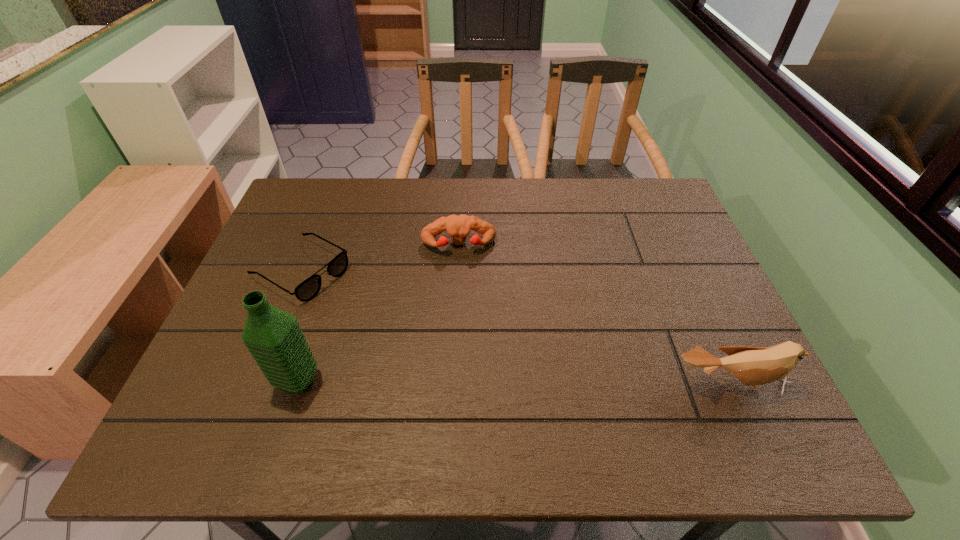
In the image, there is a desktop. At what (x,y) coordinates should I click in order to perform the action: click on free space at the left edge. Please return your answer as a coordinate pair (x, y). The image size is (960, 540). Looking at the image, I should click on (281, 233).

Identify the location of vacant region at the far left corner of the desktop. (334, 188).

Find the location of a particular element. The width and height of the screenshot is (960, 540). vacant area at the near left corner of the desktop is located at coordinates click(220, 396).

In the image, there is a desktop. Identify the location of free space at the far right corner. [655, 219].

Find the location of a particular element. free area in between the spectacles and the second tallest object is located at coordinates (516, 327).

Image resolution: width=960 pixels, height=540 pixels. Find the location of `vacant area that lies between the tallest object and the rightmost object`. vacant area that lies between the tallest object and the rightmost object is located at coordinates (514, 382).

This screenshot has width=960, height=540. I want to click on blank region between the spectacles and the rightmost object, so click(516, 327).

You are a GUI agent. You are given a task and a screenshot of the screen. Output one action in this format:
    pyautogui.click(x=<x>, y=<y>)
    Task: Click on the blank region between the second object from right to left and the shortest object
    The height and width of the screenshot is (540, 960).
    Given the screenshot: What is the action you would take?
    pyautogui.click(x=380, y=258)

Where is `unoccupied position between the second object from right to left and the tallest object`? The height and width of the screenshot is (540, 960). unoccupied position between the second object from right to left and the tallest object is located at coordinates (378, 313).

This screenshot has width=960, height=540. Find the location of `unoccupied area between the rightmost object and the third tallest object`. unoccupied area between the rightmost object and the third tallest object is located at coordinates (594, 314).